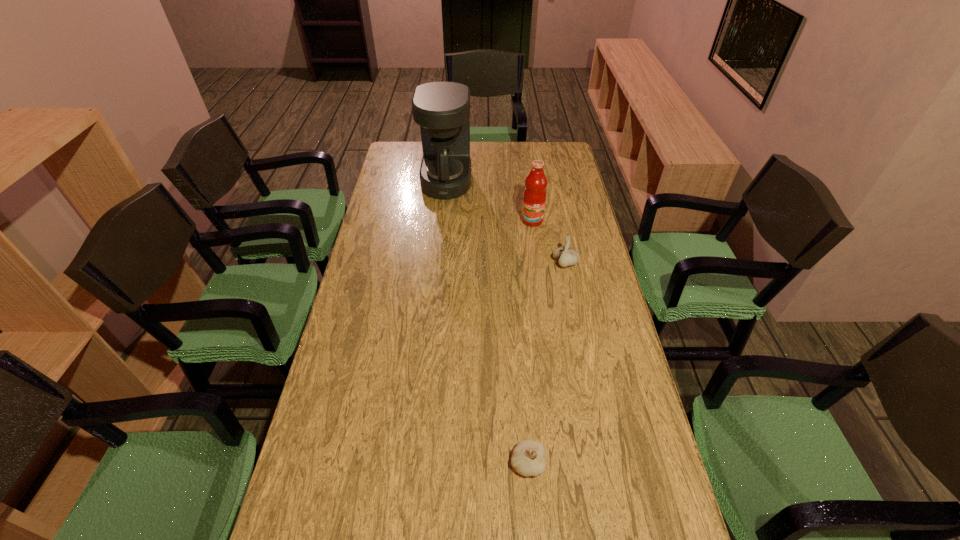
This screenshot has width=960, height=540. What are the coordinates of `vacant space that's between the nearest object and the leftmost object` in the screenshot? It's located at (487, 322).

The height and width of the screenshot is (540, 960). I want to click on vacant space in between the shortest object and the right garlic, so pos(546,363).

Locate an element on the screen. This screenshot has width=960, height=540. empty space between the coffee maker and the second object from left to right is located at coordinates (487, 322).

Find the location of a particular element. The height and width of the screenshot is (540, 960). free spot between the second farthest object and the third object from right to left is located at coordinates (530, 342).

Where is `free space between the rightmost object and the fruit juice`? The image size is (960, 540). free space between the rightmost object and the fruit juice is located at coordinates click(x=548, y=242).

Find the location of a particular element. The height and width of the screenshot is (540, 960). object that is the closest to the farther garlic is located at coordinates (534, 197).

Find the location of a particular element. This screenshot has height=540, width=960. object that is the closest one to the taller garlic is located at coordinates (534, 197).

The image size is (960, 540). In order to click on garlic that is the second closest to the third nearest object in this screenshot , I will do `click(528, 458)`.

Find the location of a particular element. free space that satisfies the following two spatial constraints: 1. on the front label of the second object from right to left; 2. on the left side of the right garlic is located at coordinates [x=538, y=263].

Find the location of a particular element. The width and height of the screenshot is (960, 540). vacant position in the image that satisfies the following two spatial constraints: 1. on the back side of the taller garlic; 2. on the button side of the farthest object is located at coordinates (549, 182).